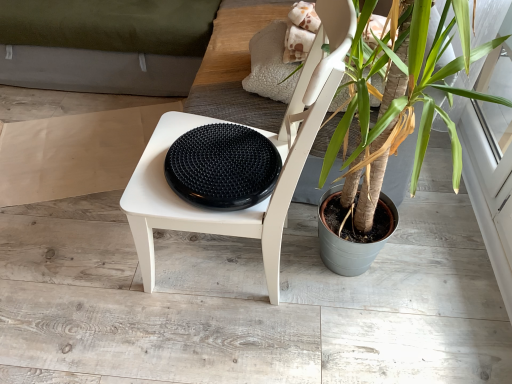
Identify the location of free space underneath white matte chair at center (from a real-world perspective). 202,258.